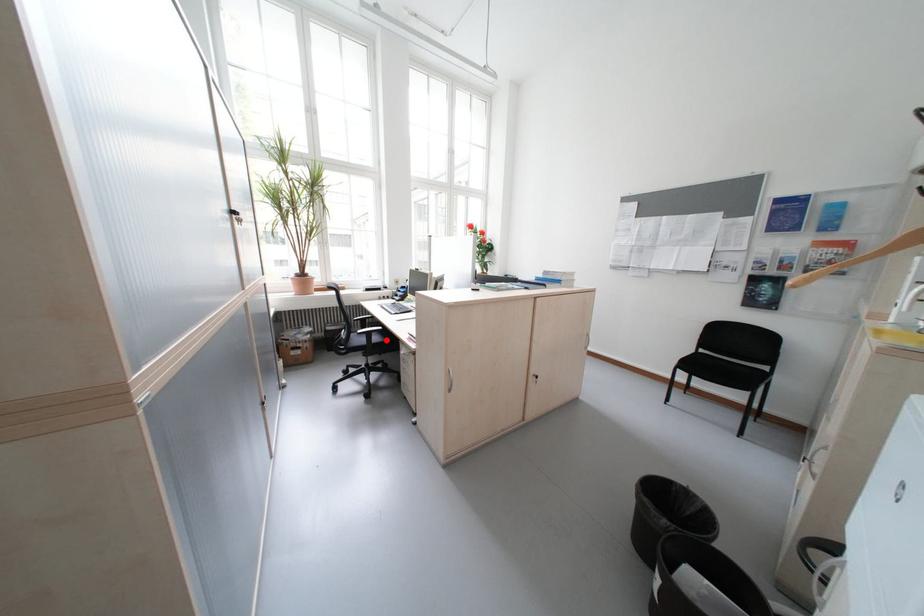
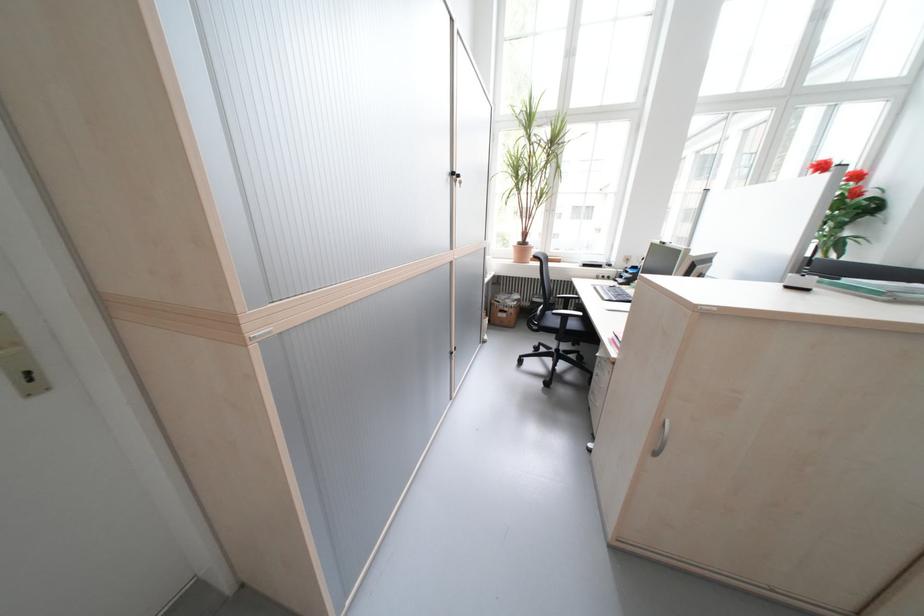
Where in the second image is the point corresponding to the highlighted location from the first image?

(582, 326)